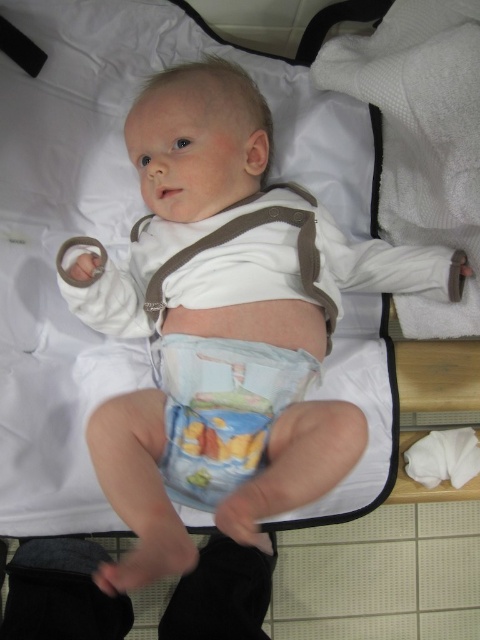
You are a caregiver preparing to change the baby. You need to decide which item is easier to fold neatly. Based on their thickness, which item would be easier to fold neatly between the blue printed fabric diaper at center and the white cotton bib at center?

The blue printed fabric diaper at center is thinner than the white cotton bib at center, so it would be easier to fold neatly.

You are a parent trying to place a new sticker on the changing table. The sticker is 3 inches wide. If you want to place it between the blue printed fabric diaper at center and the white cotton bib at center, will there be enough space?

The blue printed fabric diaper at center is 6.79 inches away from the white cotton bib at center. Since the sticker is 3 inches wide, there is enough space between them to place the sticker.